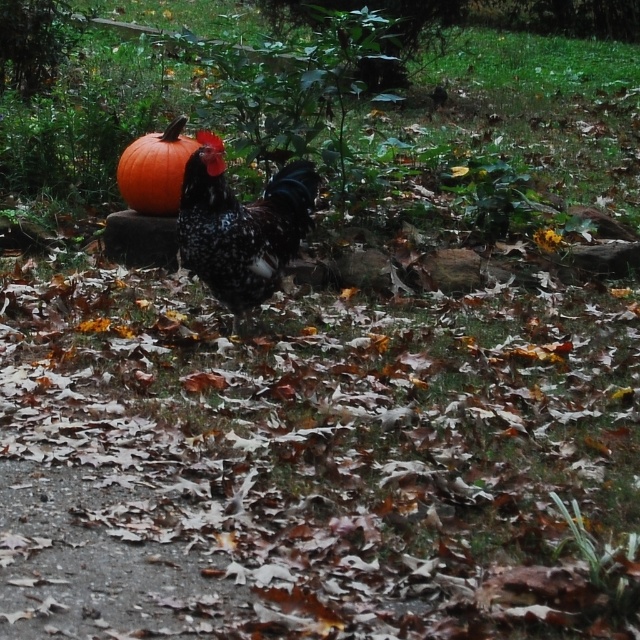
Question: Can you confirm if speckled feathered rooster at center is positioned above orange matte pumpkin at upper left?

Choices:
 (A) yes
 (B) no

Answer: (B)

Question: Does speckled feathered rooster at center have a lesser width compared to orange matte pumpkin at upper left?

Choices:
 (A) no
 (B) yes

Answer: (A)

Question: Does speckled feathered rooster at center have a larger size compared to orange matte pumpkin at upper left?

Choices:
 (A) no
 (B) yes

Answer: (B)

Question: Which object is farther from the camera taking this photo?

Choices:
 (A) speckled feathered rooster at center
 (B) orange matte pumpkin at upper left

Answer: (B)

Question: Which point is closer to the camera?

Choices:
 (A) speckled feathered rooster at center
 (B) orange matte pumpkin at upper left

Answer: (A)

Question: Which point is farther to the camera?

Choices:
 (A) (182, 172)
 (B) (285, 250)

Answer: (A)